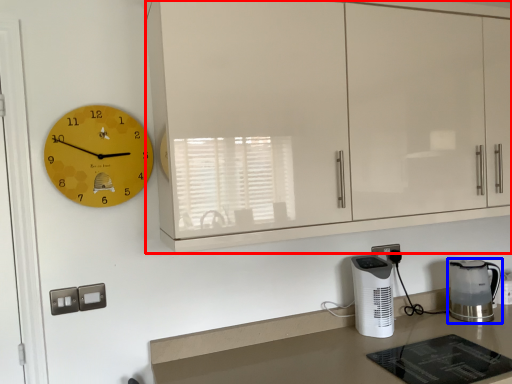
Question: Which object appears farthest to the camera in this image, cabinetry (highlighted by a red box) or home appliance (highlighted by a blue box)?

Choices:
 (A) cabinetry
 (B) home appliance

Answer: (B)